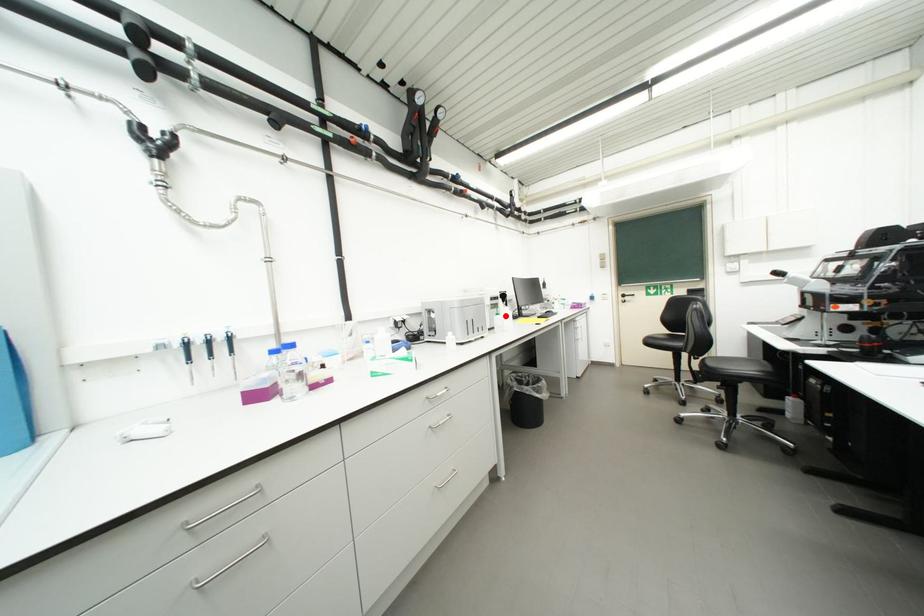
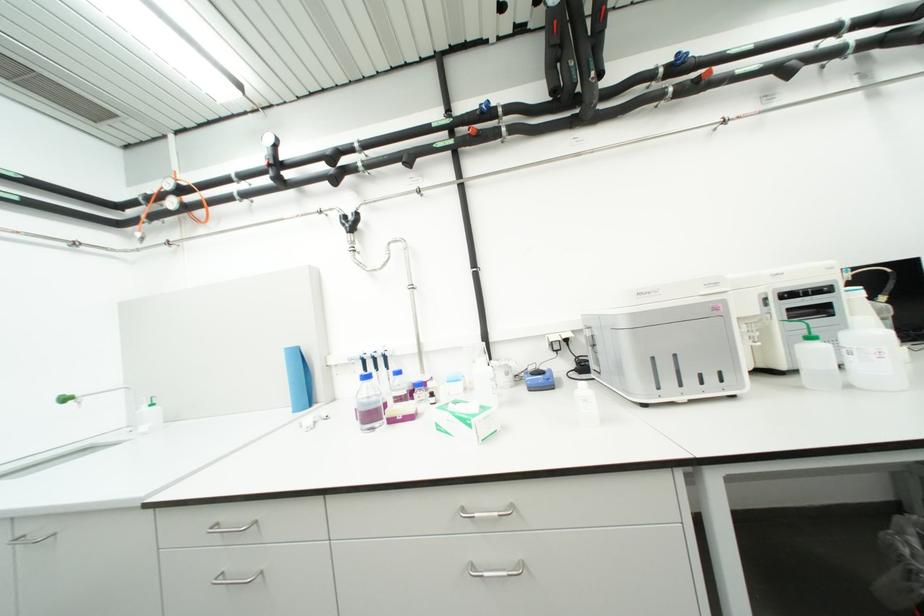
The point at the highlighted location is marked in the first image. Where is the corresponding point in the second image?

(819, 339)